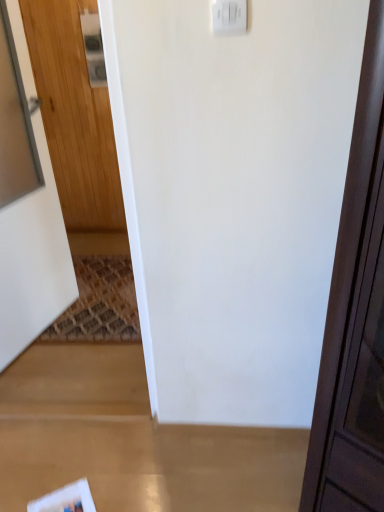
Question: Considering the relative positions of white glossy magazine at lower left and wooden door at left in the image provided, is white glossy magazine at lower left to the left of wooden door at left from the viewer's perspective?

Choices:
 (A) no
 (B) yes

Answer: (A)

Question: Is white glossy magazine at lower left to the right of wooden door at left from the viewer's perspective?

Choices:
 (A) no
 (B) yes

Answer: (B)

Question: Is the depth of white glossy magazine at lower left greater than that of wooden door at left?

Choices:
 (A) no
 (B) yes

Answer: (B)

Question: Is white glossy magazine at lower left outside wooden door at left?

Choices:
 (A) no
 (B) yes

Answer: (B)

Question: Considering the relative sizes of white glossy magazine at lower left and wooden door at left in the image provided, is white glossy magazine at lower left bigger than wooden door at left?

Choices:
 (A) no
 (B) yes

Answer: (A)

Question: From a real-world perspective, is wooden door at left physically located above or below white plastic light switch at upper center, placed as the first light switch when sorted from back to front?

Choices:
 (A) below
 (B) above

Answer: (A)

Question: Is wooden door at left situated inside white plastic light switch at upper center, which is the 2th light switch from front to back, or outside?

Choices:
 (A) outside
 (B) inside

Answer: (A)

Question: Would you say wooden door at left is to the left or to the right of white plastic light switch at upper center, which is the 2th light switch from front to back, in the picture?

Choices:
 (A) right
 (B) left

Answer: (B)

Question: In terms of height, does wooden door at left look taller or shorter compared to white plastic light switch at upper center, positioned as the first light switch in left-to-right order?

Choices:
 (A) short
 (B) tall

Answer: (B)

Question: In terms of height, does white plastic light switch at upper center, the 1th light switch in the bottom-to-top sequence, look taller or shorter compared to wooden door at left?

Choices:
 (A) tall
 (B) short

Answer: (B)

Question: Is white plastic light switch at upper center, the 2th light switch in the back-to-front sequence, bigger or smaller than wooden door at left?

Choices:
 (A) big
 (B) small

Answer: (B)

Question: Considering the positions of white plastic light switch at upper center, the 1th light switch in the bottom-to-top sequence, and wooden door at left in the image, is white plastic light switch at upper center, the 1th light switch in the bottom-to-top sequence, wider or thinner than wooden door at left?

Choices:
 (A) thin
 (B) wide

Answer: (A)

Question: From the image's perspective, is white plastic light switch at upper center, the 1th light switch in the bottom-to-top sequence, located above or below wooden door at left?

Choices:
 (A) above
 (B) below

Answer: (A)

Question: From their relative heights in the image, would you say white glossy magazine at lower left is taller or shorter than wooden door at left?

Choices:
 (A) short
 (B) tall

Answer: (A)

Question: Based on their sizes in the image, would you say white glossy magazine at lower left is bigger or smaller than wooden door at left?

Choices:
 (A) big
 (B) small

Answer: (B)